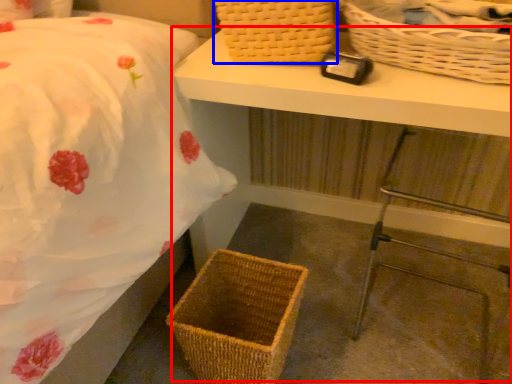
Question: Which object is closer to the camera taking this photo, table (highlighted by a red box) or picnic basket (highlighted by a blue box)?

Choices:
 (A) table
 (B) picnic basket

Answer: (A)